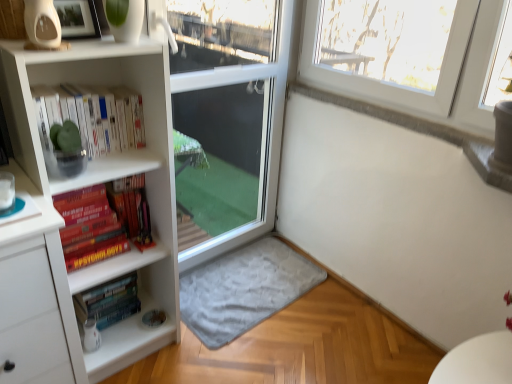
Identify the location of free space in front of gray soft rug at lower center. This screenshot has height=384, width=512. (259, 357).